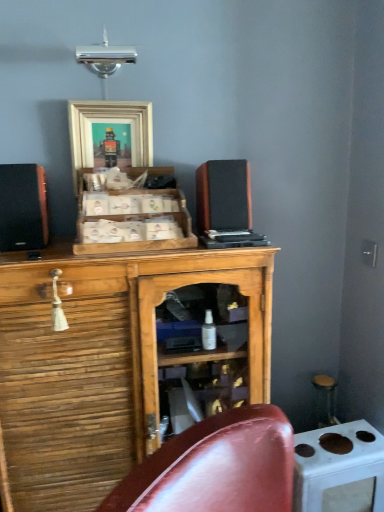
Question: Which direction should I rotate to look at wooden cabinet at center, the first cabinetry positioned from the bottom, — up or down?

Choices:
 (A) down
 (B) up

Answer: (A)

Question: Can we say wooden cabinet at center, the first cabinetry positioned from the bottom, lies outside wooden crate at center, which appears as the first cabinetry when viewed from the top?

Choices:
 (A) yes
 (B) no

Answer: (A)

Question: Does wooden cabinet at center, the first cabinetry positioned from the bottom, have a greater height compared to wooden crate at center, which is counted as the second cabinetry, starting from the bottom?

Choices:
 (A) no
 (B) yes

Answer: (B)

Question: Is wooden cabinet at center, placed as the 2th cabinetry when sorted from top to bottom, far away from wooden crate at center, which is counted as the second cabinetry, starting from the bottom?

Choices:
 (A) yes
 (B) no

Answer: (B)

Question: Considering the relative sizes of wooden cabinet at center, placed as the 2th cabinetry when sorted from top to bottom, and wooden crate at center, which appears as the first cabinetry when viewed from the top, in the image provided, is wooden cabinet at center, placed as the 2th cabinetry when sorted from top to bottom, smaller than wooden crate at center, which appears as the first cabinetry when viewed from the top,?

Choices:
 (A) yes
 (B) no

Answer: (B)

Question: Does wooden cabinet at center, placed as the 2th cabinetry when sorted from top to bottom, come in front of wooden crate at center, which is counted as the second cabinetry, starting from the bottom?

Choices:
 (A) yes
 (B) no

Answer: (A)

Question: Considering the relative positions of wooden cabinet at center, placed as the 2th cabinetry when sorted from top to bottom, and wooden crate at center, which is counted as the second cabinetry, starting from the bottom, in the image provided, is wooden cabinet at center, placed as the 2th cabinetry when sorted from top to bottom, behind wooden crate at center, which is counted as the second cabinetry, starting from the bottom,?

Choices:
 (A) yes
 (B) no

Answer: (B)

Question: From a real-world perspective, is white glossy stove at lower right below wooden speaker at center, the 2th speaker viewed from the left?

Choices:
 (A) no
 (B) yes

Answer: (B)

Question: Considering the relative positions of white glossy stove at lower right and wooden speaker at center, the 2th speaker viewed from the left, in the image provided, is white glossy stove at lower right to the right of wooden speaker at center, the 2th speaker viewed from the left, from the viewer's perspective?

Choices:
 (A) no
 (B) yes

Answer: (B)

Question: Does white glossy stove at lower right lie in front of wooden speaker at center, which appears as the 1th speaker when viewed from the right?

Choices:
 (A) yes
 (B) no

Answer: (B)

Question: Is white glossy stove at lower right positioned beyond the bounds of wooden speaker at center, which appears as the 1th speaker when viewed from the right?

Choices:
 (A) yes
 (B) no

Answer: (A)

Question: Does white glossy stove at lower right contain wooden speaker at center, which appears as the 1th speaker when viewed from the right?

Choices:
 (A) no
 (B) yes

Answer: (A)

Question: Can you confirm if white glossy stove at lower right is taller than wooden speaker at center, the 2th speaker viewed from the left?

Choices:
 (A) yes
 (B) no

Answer: (A)

Question: Can you confirm if wooden crate at center, which is counted as the second cabinetry, starting from the bottom, is bigger than wooden speaker at center, which appears as the 1th speaker when viewed from the right?

Choices:
 (A) no
 (B) yes

Answer: (B)